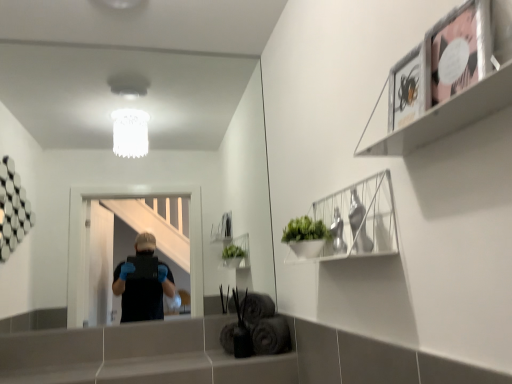
Question: Considering the relative positions of smooth gray ledge at lower center and matte black picture frame at upper right in the image provided, is smooth gray ledge at lower center to the left or to the right of matte black picture frame at upper right?

Choices:
 (A) left
 (B) right

Answer: (A)

Question: Looking at their shapes, would you say smooth gray ledge at lower center is wider or thinner than matte black picture frame at upper right?

Choices:
 (A) wide
 (B) thin

Answer: (A)

Question: Which object is the closest to the metallic silver frame at upper right?

Choices:
 (A) matte black picture frame at upper right
 (B) white wire basket at upper right
 (C) smooth gray ledge at lower center

Answer: (A)

Question: Considering the real-world distances, which object is farthest from the metallic silver frame at upper right?

Choices:
 (A) smooth gray ledge at lower center
 (B) white wire basket at upper right
 (C) matte black picture frame at upper right

Answer: (A)